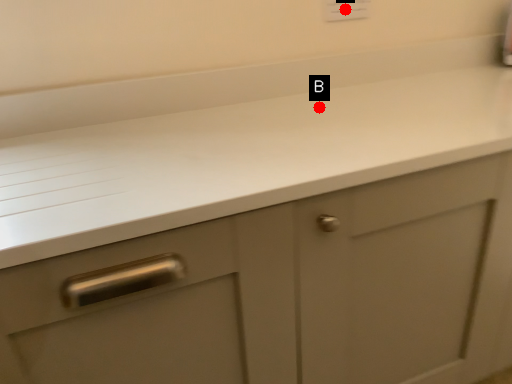
Question: Two points are circled on the image, labeled by A and B beside each circle. Which point appears farthest from the camera in this image?

Choices:
 (A) A is further
 (B) B is further

Answer: (A)